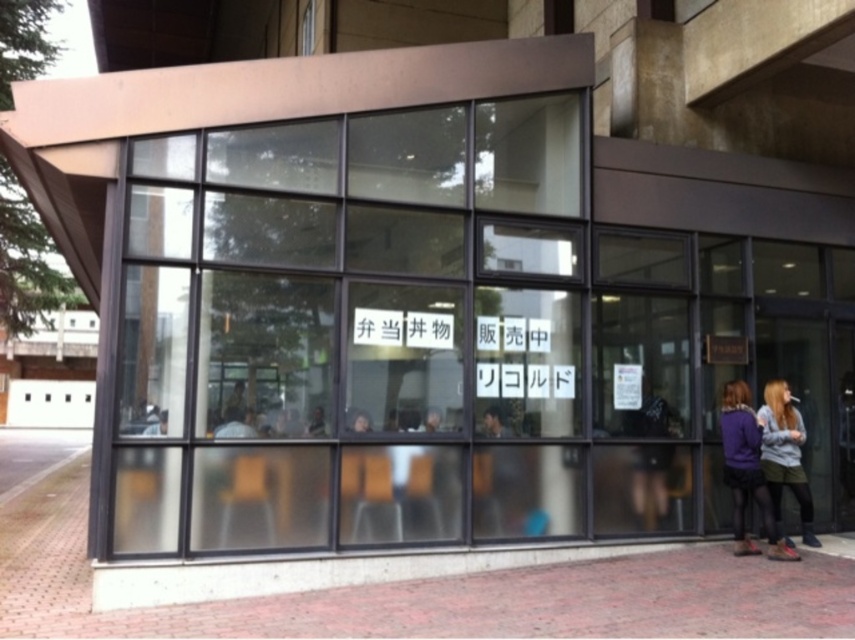
Question: Is transparent glass window at center thinner than matte purple hoodie at lower right?

Choices:
 (A) no
 (B) yes

Answer: (A)

Question: Which point is closer to the camera taking this photo?

Choices:
 (A) (239, 285)
 (B) (603, 609)

Answer: (B)

Question: Considering the real-world distances, which object is farthest from the matte purple hoodie at lower right?

Choices:
 (A) transparent glass window at center
 (B) brick pavement at lower center

Answer: (A)

Question: Does transparent glass window at center appear on the left side of brick pavement at lower center?

Choices:
 (A) no
 (B) yes

Answer: (A)

Question: Which object appears closest to the camera in this image?

Choices:
 (A) transparent glass window at center
 (B) matte purple hoodie at lower right

Answer: (A)

Question: Does brick pavement at lower center have a greater width compared to matte purple hoodie at lower right?

Choices:
 (A) yes
 (B) no

Answer: (A)